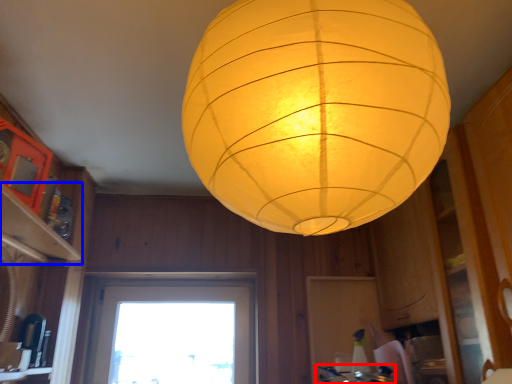
Question: Which object is further to the camera taking this photo, gas stove (highlighted by a red box) or shelf (highlighted by a blue box)?

Choices:
 (A) gas stove
 (B) shelf

Answer: (A)